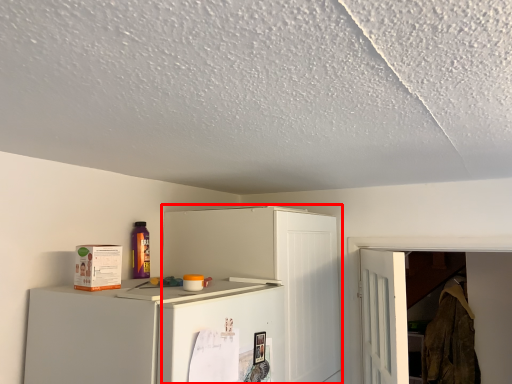
Question: From the image's perspective, considering the relative positions of cabinetry (annotated by the red box) and laundry in the image provided, where is cabinetry (annotated by the red box) located with respect to the staircase?

Choices:
 (A) below
 (B) above

Answer: (B)